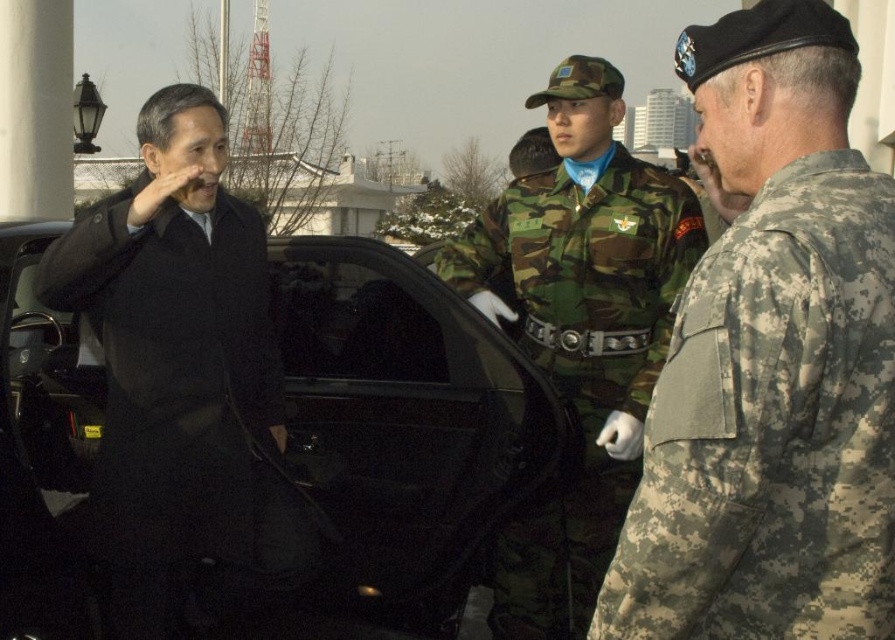
You are a tailor who needs to determine which item requires more fabric to make between the black wool coat at left and the camo fabric uniform at center. Based on their thickness, which one would need more fabric?

The black wool coat at left is thinner than the camo fabric uniform at center, so the camo fabric uniform at center requires more fabric to make.

You are standing at point A, which is at coordinates point (49, 272), and you want to walk to point B, which is at coordinates point (499, 246). Which direction should you move to get closer to point B?

To move from point A at coordinates point (49, 272) to point B at coordinates point (499, 246), you should move in a direction that is upwards and to the left, as point B is located above and to the left of point A.